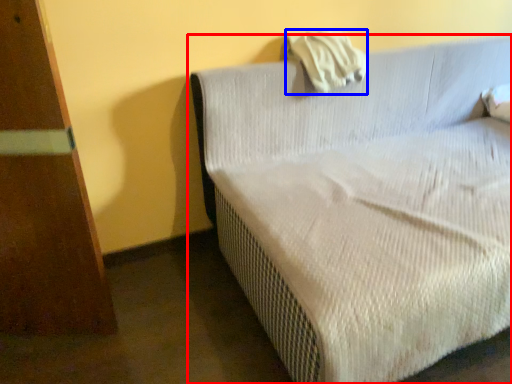
Question: Among these objects, which one is nearest to the camera, studio couch (highlighted by a red box) or pillow (highlighted by a blue box)?

Choices:
 (A) studio couch
 (B) pillow

Answer: (A)